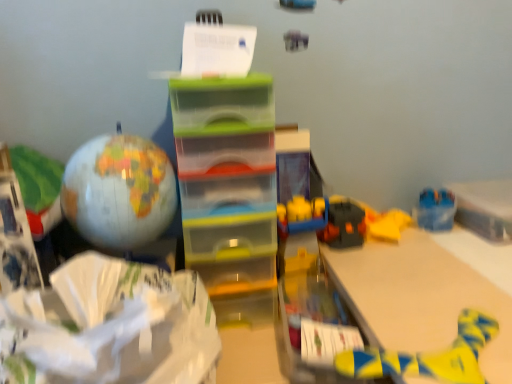
Question: In the image, is yellow fabric toy at lower right on the left side or the right side of matte globe at left?

Choices:
 (A) left
 (B) right

Answer: (B)

Question: Relative to matte globe at left, is yellow fabric toy at lower right in front or behind?

Choices:
 (A) front
 (B) behind

Answer: (A)

Question: Which object is the closest to the matte globe at left?

Choices:
 (A) yellow fabric toy at lower right
 (B) white matte wrapping paper at lower left
 (C) white paper at upper center

Answer: (B)

Question: Estimate the real-world distances between objects in this image. Which object is closer to the white matte wrapping paper at lower left?

Choices:
 (A) white paper at upper center
 (B) yellow fabric toy at lower right
 (C) matte globe at left

Answer: (C)